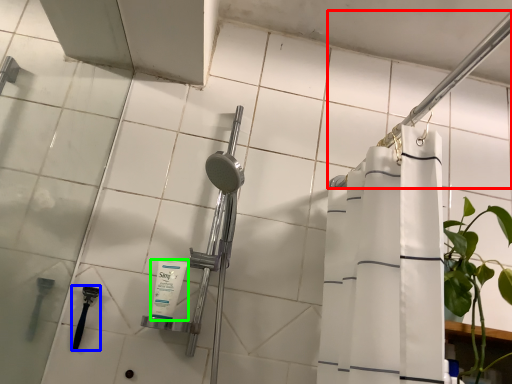
Question: Based on their relative distances, which object is nearer to shower (highlighted by a red box)? Choose from shower (highlighted by a blue box) and toiletry (highlighted by a green box).

Choices:
 (A) shower
 (B) toiletry

Answer: (B)